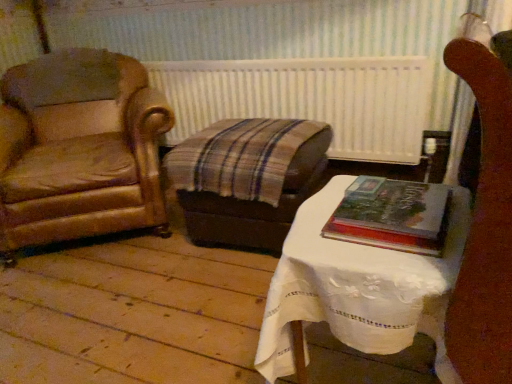
Find the location of a particular element. Image resolution: width=512 pixels, height=384 pixels. vacant area on top of hardcover book at center right (from a real-world perspective) is located at coordinates (390, 194).